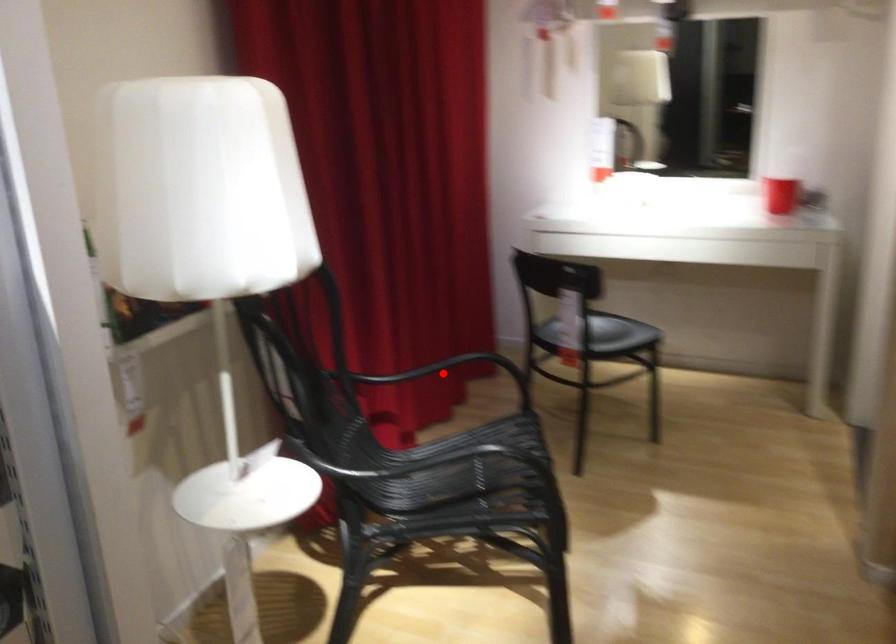
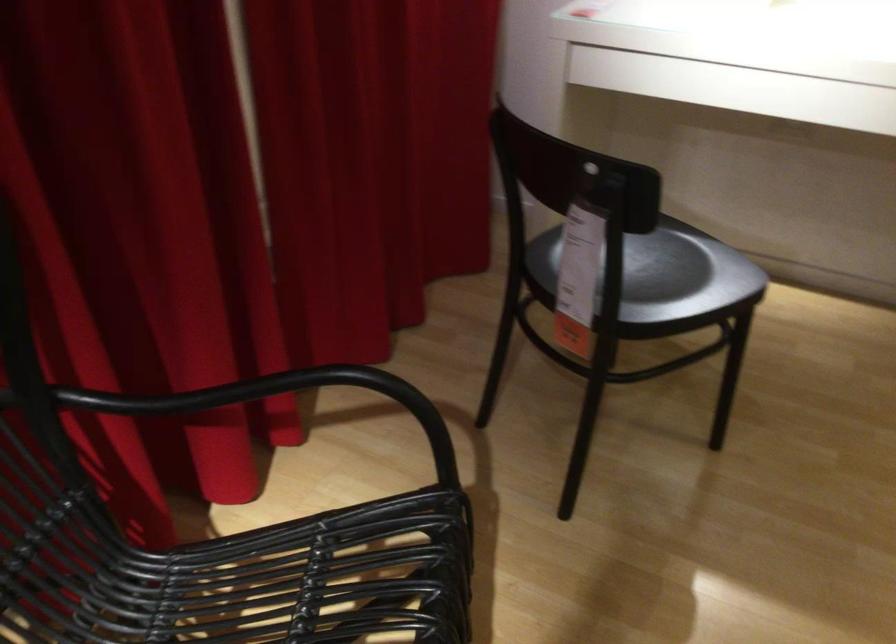
Question: A red point is marked in image1. In image2, is the corresponding 3D point closer to the camera or farther? Reply with the corresponding letter.

Choices:
 (A) The corresponding 3D point is closer.
 (B) The corresponding 3D point is farther.

Answer: (A)